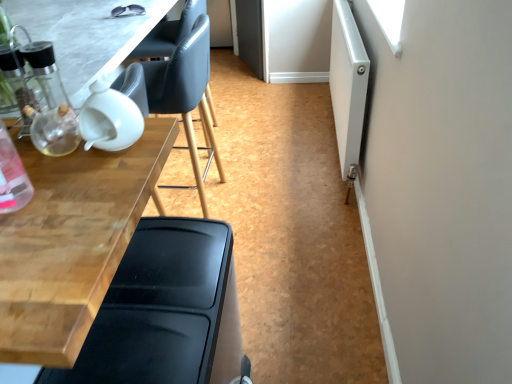
At what (x,y) coordinates should I click in order to perform the action: click on vacant space in between matte black chair at upper left, which ranks as the first chair in back-to-front order, and white matte screen door at right. Please return your answer as a coordinate pair (x, y). Looking at the image, I should click on (279, 160).